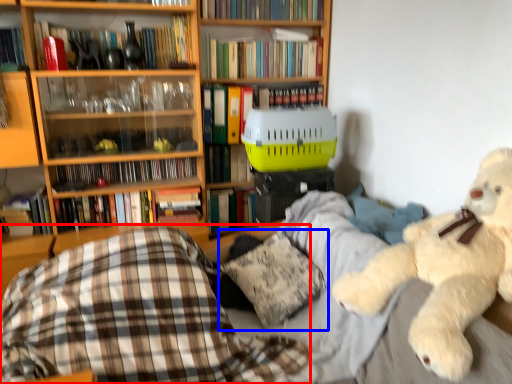
Question: Which object is closer to the camera taking this photo, plaid (highlighted by a red box) or pillow (highlighted by a blue box)?

Choices:
 (A) plaid
 (B) pillow

Answer: (A)